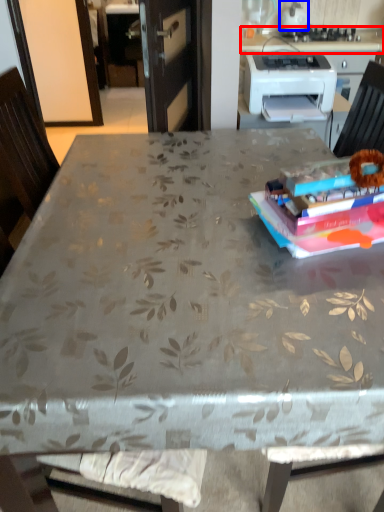
Question: Which point is closer to the camera, counter top (highlighted by a red box) or kitchen appliance (highlighted by a blue box)?

Choices:
 (A) counter top
 (B) kitchen appliance

Answer: (A)